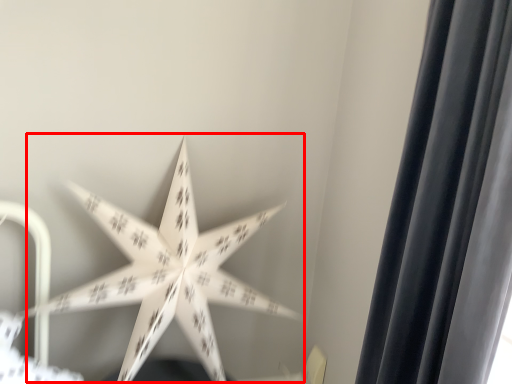
Question: From the image's perspective, what is the correct spatial relationship of star (annotated by the red box) in relation to curtain?

Choices:
 (A) above
 (B) below

Answer: (B)